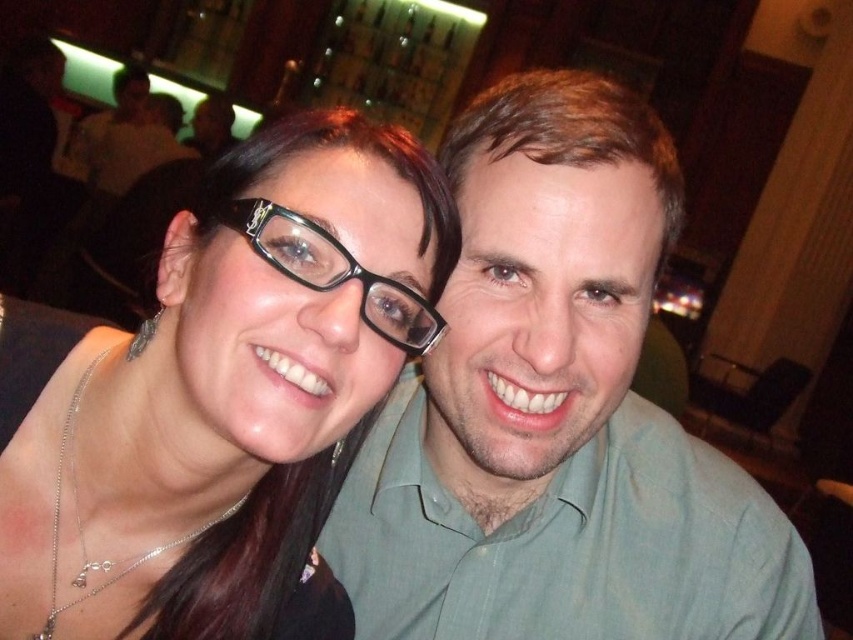
Does point (780, 600) lie behind point (300, 220)?

Yes, it is behind point (300, 220).

Between point (465, 582) and point (398, 292), which one is positioned in front?

Point (398, 292) is in front.

Between point (541, 413) and point (376, 282), which one is positioned in front?

Point (376, 282)

Where is `green textured shirt at center`? green textured shirt at center is located at coordinates (556, 413).

Does green textured shirt at center appear on the right side of matte black glasses at upper left?

Yes, green textured shirt at center is to the right of matte black glasses at upper left.

Between point (646, 454) and point (259, 317), which one is positioned behind?

The point (646, 454) is behind.

At what (x,y) coordinates should I click in order to perform the action: click on green textured shirt at center. Please return your answer as a coordinate pair (x, y). The width and height of the screenshot is (853, 640). Looking at the image, I should click on (556, 413).

Who is more forward, (102, 488) or (235, 198)?

Positioned in front is point (235, 198).

This screenshot has height=640, width=853. Describe the element at coordinates (219, 396) in the screenshot. I see `matte black glasses at upper left` at that location.

In order to click on matte black glasses at upper left in this screenshot , I will do `click(219, 396)`.